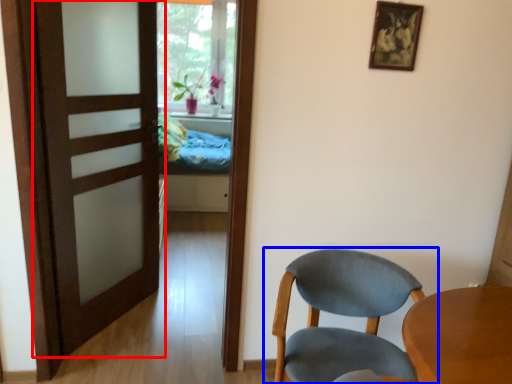
Question: Which object appears closest to the camera in this image, door (highlighted by a red box) or chair (highlighted by a blue box)?

Choices:
 (A) door
 (B) chair

Answer: (B)